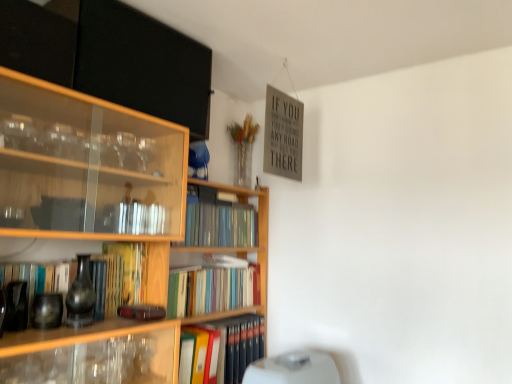
Find the location of a particular element. hardcover books at center, the 1th book when ordered from top to bottom is located at coordinates (219, 223).

Image resolution: width=512 pixels, height=384 pixels. Describe the element at coordinates (226, 287) in the screenshot. I see `wooden bookcase at center` at that location.

Describe the element at coordinates (118, 278) in the screenshot. I see `matte black book at left, marked as the 2th book in a top-to-bottom arrangement` at that location.

Where is `hardcover book at center, placed as the 3th book when sorted from top to bottom`? The height and width of the screenshot is (384, 512). hardcover book at center, placed as the 3th book when sorted from top to bottom is located at coordinates (210, 289).

At what (x,y) coordinates should I click in order to perform the action: click on bookcase above the hardcover book at center, which ranks as the 4th book in top-to-bottom order (from the image's perspective). Please return your answer as a coordinate pair (x, y). This screenshot has width=512, height=384. Looking at the image, I should click on (226, 287).

Which of these two, hardcover book at center, which ranks as the 4th book in top-to-bottom order, or wooden bookcase at center, is wider?

wooden bookcase at center.

Is hardcover book at center, which ranks as the 4th book in top-to-bottom order, turned away from wooden bookcase at center?

Yes, hardcover book at center, which ranks as the 4th book in top-to-bottom order,'s orientation is away from wooden bookcase at center.

Can you tell me how much white plastic water heater at lower center and hardcover book at center, the 2th book positioned from the bottom, differ in facing direction?

The angle between the facing direction of white plastic water heater at lower center and the facing direction of hardcover book at center, the 2th book positioned from the bottom, is 0.39 degrees.

Can you confirm if white plastic water heater at lower center is shorter than hardcover book at center, placed as the 3th book when sorted from top to bottom?

Incorrect, the height of white plastic water heater at lower center does not fall short of that of hardcover book at center, placed as the 3th book when sorted from top to bottom.

From the image's perspective, which object appears higher, white plastic water heater at lower center or hardcover book at center, placed as the 3th book when sorted from top to bottom?

hardcover book at center, placed as the 3th book when sorted from top to bottom, appears higher in the image.

Who is smaller, white plastic water heater at lower center or hardcover book at center, placed as the 3th book when sorted from top to bottom?

Smaller between the two is hardcover book at center, placed as the 3th book when sorted from top to bottom.

How much distance is there between matte black book at left, the 3th book from the bottom, and hardcover books at center, placed as the 4th book when sorted from bottom to top?

matte black book at left, the 3th book from the bottom, is 51.49 centimeters from hardcover books at center, placed as the 4th book when sorted from bottom to top.

Is matte black book at left, the 3th book from the bottom, completely or partially outside of hardcover books at center, the 1th book when ordered from top to bottom?

matte black book at left, the 3th book from the bottom, lies outside hardcover books at center, the 1th book when ordered from top to bottom,'s area.

Can you tell me how much matte black book at left, the 3th book from the bottom, and hardcover books at center, placed as the 4th book when sorted from bottom to top, differ in facing direction?

The angular difference between matte black book at left, the 3th book from the bottom, and hardcover books at center, placed as the 4th book when sorted from bottom to top, is 1.26 degrees.

From a real-world perspective, is matte black book at left, marked as the 2th book in a top-to-bottom arrangement, positioned above or below hardcover books at center, the 1th book when ordered from top to bottom?

matte black book at left, marked as the 2th book in a top-to-bottom arrangement, is below hardcover books at center, the 1th book when ordered from top to bottom.

Is hardcover books at center, placed as the 4th book when sorted from bottom to top, aimed at white plastic water heater at lower center?

No, hardcover books at center, placed as the 4th book when sorted from bottom to top, is not facing towards white plastic water heater at lower center.

Between point (188, 220) and point (273, 376), which one is positioned in front?

The point (273, 376) is closer.

In terms of size, does hardcover books at center, placed as the 4th book when sorted from bottom to top, appear bigger or smaller than white plastic water heater at lower center?

hardcover books at center, placed as the 4th book when sorted from bottom to top, is smaller than white plastic water heater at lower center.

Is hardcover books at center, placed as the 4th book when sorted from bottom to top, completely or partially outside of wooden bookcase at center?

No, most part of hardcover books at center, placed as the 4th book when sorted from bottom to top, lies within wooden bookcase at center.

Does point (205, 204) lie in front of point (234, 303)?

Yes, it is.

From the image's perspective, which one is positioned lower, hardcover books at center, the 1th book when ordered from top to bottom, or wooden bookcase at center?

From the image's view, wooden bookcase at center is below.

Is hardcover books at center, the 1th book when ordered from top to bottom, turned away from wooden bookcase at center?

Correct, hardcover books at center, the 1th book when ordered from top to bottom, is looking away from wooden bookcase at center.

Which book is the 2nd one when counting from the front of the hardcover book at center, marked as the first book in a bottom-to-top arrangement? Please provide its 2D coordinates.

[(210, 289)]

Is hardcover book at center, the 2th book positioned from the bottom, directly adjacent to hardcover book at center, which ranks as the 4th book in top-to-bottom order?

No, hardcover book at center, the 2th book positioned from the bottom, is not with hardcover book at center, which ranks as the 4th book in top-to-bottom order.

Can hardcover book at center, which ranks as the 4th book in top-to-bottom order, be found inside hardcover book at center, placed as the 3th book when sorted from top to bottom?

No, hardcover book at center, which ranks as the 4th book in top-to-bottom order, is not inside hardcover book at center, placed as the 3th book when sorted from top to bottom.

Does matte black book at left, the 3th book from the bottom, turn towards wooden bookcase at center?

No, matte black book at left, the 3th book from the bottom, does not turn towards wooden bookcase at center.

Do you think matte black book at left, marked as the 2th book in a top-to-bottom arrangement, is within wooden bookcase at center, or outside of it?

matte black book at left, marked as the 2th book in a top-to-bottom arrangement, is not enclosed by wooden bookcase at center.

From the image's perspective, which object appears higher, matte black book at left, the 3th book from the bottom, or wooden bookcase at center?

matte black book at left, the 3th book from the bottom.

Is point (104, 256) positioned behind point (185, 303)?

No, (104, 256) is in front of (185, 303).

Locate an element on the screen. Image resolution: width=512 pixels, height=384 pixels. bookcase that appears in front of the hardcover book at center, marked as the first book in a bottom-to-top arrangement is located at coordinates (226, 287).

I want to click on water heater below the hardcover book at center, placed as the 3th book when sorted from top to bottom (from a real-world perspective), so click(293, 369).

Estimate the real-world distances between objects in this image. Which object is closer to hardcover book at center, placed as the 3th book when sorted from top to bottom, wooden bookcase at center or white plastic water heater at lower center?

Based on the image, wooden bookcase at center appears to be nearer to hardcover book at center, placed as the 3th book when sorted from top to bottom.

When comparing their distances from matte black book at left, marked as the 2th book in a top-to-bottom arrangement, does hardcover books at center, placed as the 4th book when sorted from bottom to top, or white plastic water heater at lower center seem closer?

The object closer to matte black book at left, marked as the 2th book in a top-to-bottom arrangement, is hardcover books at center, placed as the 4th book when sorted from bottom to top.

Looking at the image, which one is located further to hardcover book at center, which ranks as the 4th book in top-to-bottom order, wooden bookcase at center or white plastic water heater at lower center?

Among the two, white plastic water heater at lower center is located further to hardcover book at center, which ranks as the 4th book in top-to-bottom order.

Considering their positions, is matte black book at left, the 3th book from the bottom, positioned closer to wooden bookcase at center than hardcover books at center, placed as the 4th book when sorted from bottom to top?

hardcover books at center, placed as the 4th book when sorted from bottom to top, is closer to wooden bookcase at center.

Looking at the image, which one is located further to white plastic water heater at lower center, matte black book at left, marked as the 2th book in a top-to-bottom arrangement, or wooden bookcase at center?

matte black book at left, marked as the 2th book in a top-to-bottom arrangement, is positioned further to the anchor white plastic water heater at lower center.

Looking at the image, which one is located further to hardcover book at center, marked as the first book in a bottom-to-top arrangement, white plastic water heater at lower center or hardcover book at center, the 2th book positioned from the bottom?

white plastic water heater at lower center is further to hardcover book at center, marked as the first book in a bottom-to-top arrangement.

From the image, which object appears to be farther from hardcover book at center, the 2th book positioned from the bottom, hardcover books at center, the 1th book when ordered from top to bottom, or wooden bookcase at center?

hardcover books at center, the 1th book when ordered from top to bottom, is positioned further to the anchor hardcover book at center, the 2th book positioned from the bottom.

Considering their positions, is matte black book at left, marked as the 2th book in a top-to-bottom arrangement, positioned further to hardcover books at center, the 1th book when ordered from top to bottom, than hardcover book at center, which ranks as the 4th book in top-to-bottom order?

Among the two, matte black book at left, marked as the 2th book in a top-to-bottom arrangement, is located further to hardcover books at center, the 1th book when ordered from top to bottom.

Locate an element on the screen. The width and height of the screenshot is (512, 384). water heater that lies between hardcover books at center, the 1th book when ordered from top to bottom, and hardcover book at center, which ranks as the 4th book in top-to-bottom order, from top to bottom is located at coordinates (293, 369).

You are a GUI agent. You are given a task and a screenshot of the screen. Output one action in this format:
    pyautogui.click(x=<x>, y=<y>)
    Task: Click on the bookcase between matte black book at left, the 3th book from the bottom, and white plastic water heater at lower center
    The width and height of the screenshot is (512, 384).
    Given the screenshot: What is the action you would take?
    pyautogui.click(x=226, y=287)

At what (x,y) coordinates should I click in order to perform the action: click on bookcase between hardcover books at center, the 1th book when ordered from top to bottom, and hardcover book at center, which ranks as the 4th book in top-to-bottom order, in the up-down direction. Please return your answer as a coordinate pair (x, y). This screenshot has height=384, width=512. Looking at the image, I should click on (226, 287).

What are the coordinates of `bookcase that lies between hardcover book at center, the 2th book positioned from the bottom, and hardcover book at center, marked as the first book in a bottom-to-top arrangement, from top to bottom` in the screenshot? It's located at (226, 287).